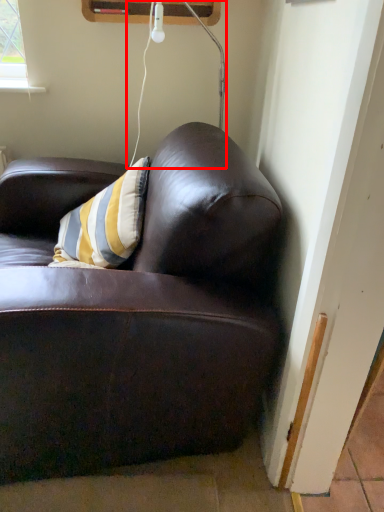
Question: In this image, where is lamp (annotated by the red box) located relative to studio couch?

Choices:
 (A) left
 (B) right

Answer: (B)